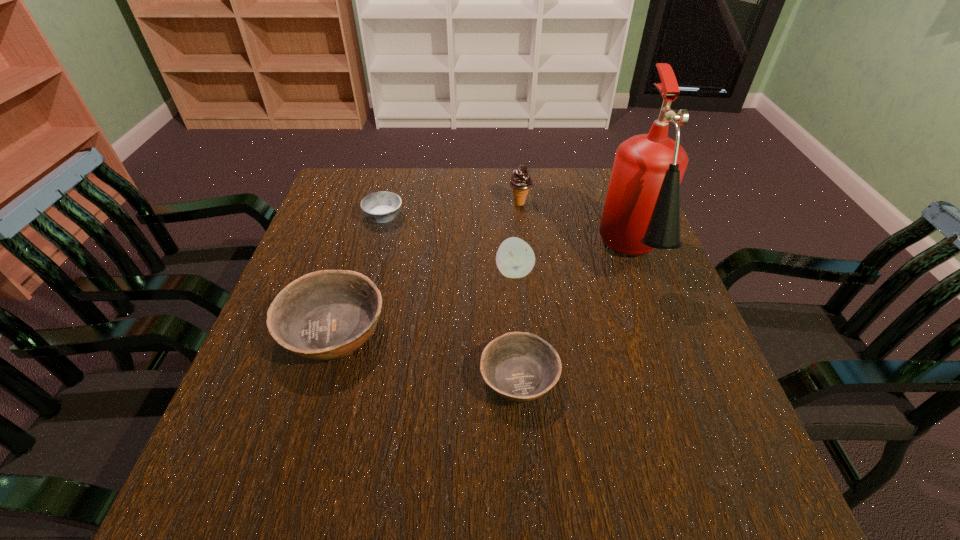
Find the location of `free location located 0.220m on the front of the second tallest object`. free location located 0.220m on the front of the second tallest object is located at coordinates (526, 262).

What are the coordinates of `vacant space located 0.350m on the front of the ashtray` in the screenshot? It's located at (353, 332).

This screenshot has width=960, height=540. I want to click on vacant area situated with the nozzle aimed from the fire extinguisher, so click(x=659, y=326).

Find the location of a particular element. free region located on the back of the apple is located at coordinates (508, 186).

At what (x,y) coordinates should I click in order to perform the action: click on icecream at the far edge. Please return your answer as a coordinate pair (x, y). Looking at the image, I should click on (520, 181).

At what (x,y) coordinates should I click in order to perform the action: click on ashtray that is at the far edge. Please return your answer as a coordinate pair (x, y). This screenshot has height=540, width=960. Looking at the image, I should click on (381, 207).

Where is `object located in the near edge section of the desktop`? object located in the near edge section of the desktop is located at coordinates (519, 366).

Where is `bowl situated at the left edge`? bowl situated at the left edge is located at coordinates (327, 314).

What are the coordinates of `ashtray at the left edge` in the screenshot? It's located at (381, 207).

Find the location of a particular element. object that is at the right edge is located at coordinates (641, 212).